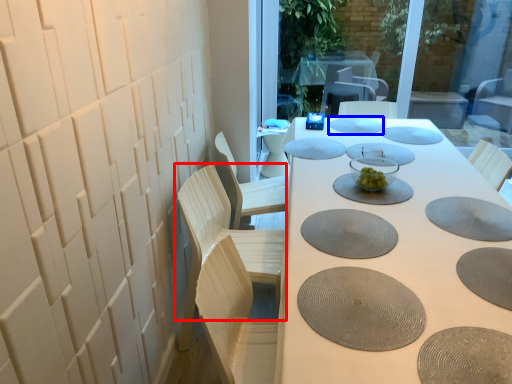
Question: Which point is closer to the camera, chair (highlighted by a red box) or manhole cover (highlighted by a blue box)?

Choices:
 (A) chair
 (B) manhole cover

Answer: (A)